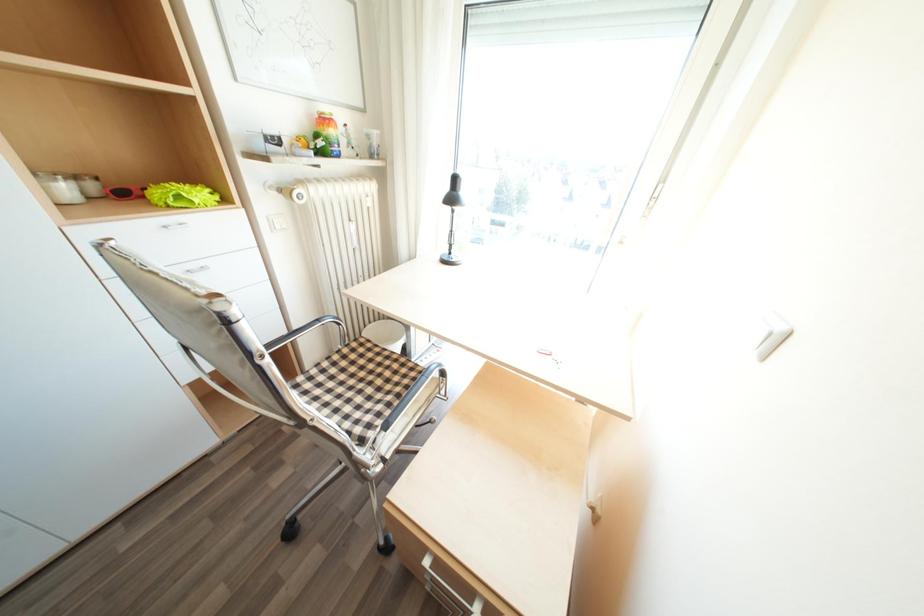
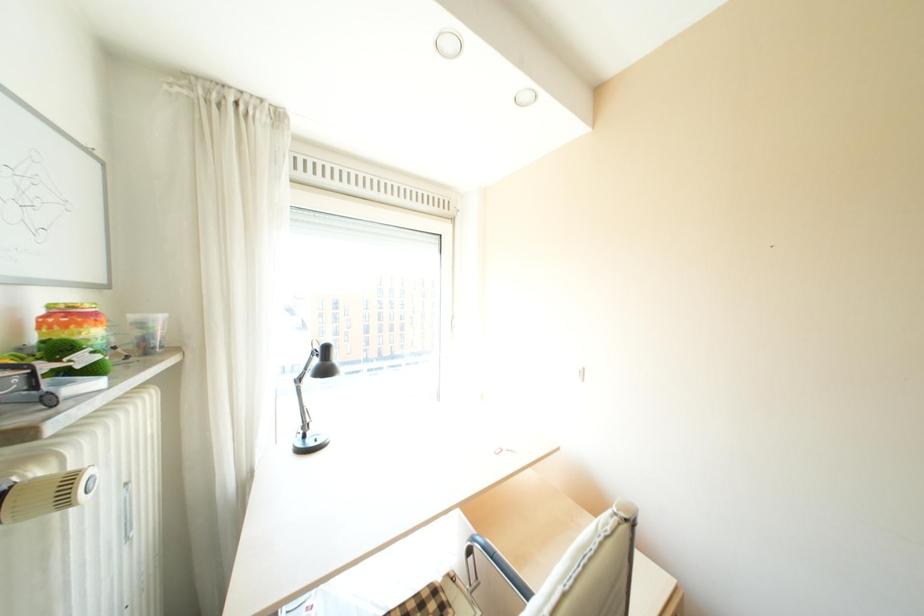
Question: The images are taken continuously from a first-person perspective. In which direction is your viewpoint rotating?

Choices:
 (A) Left
 (B) Right
 (C) Up
 (D) Down

Answer: (B)